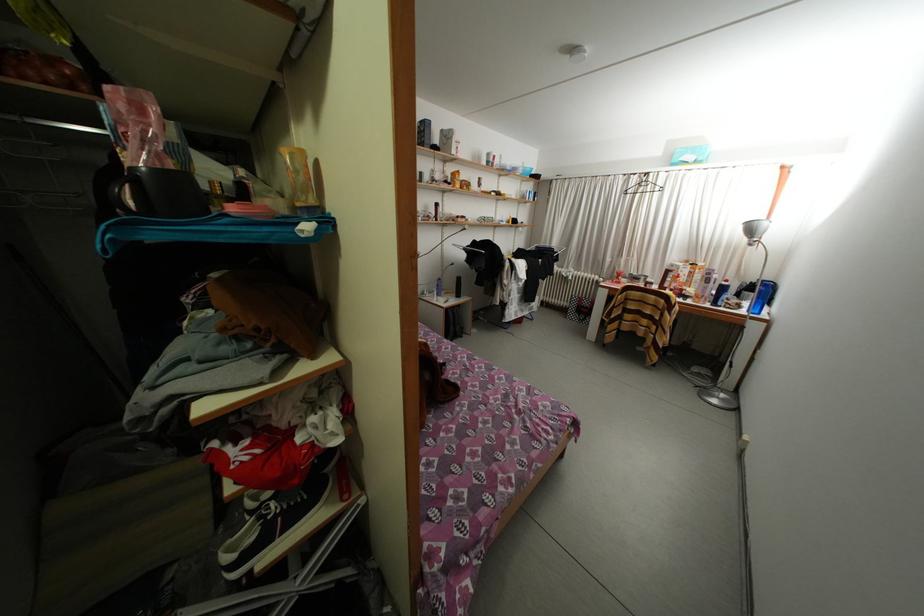
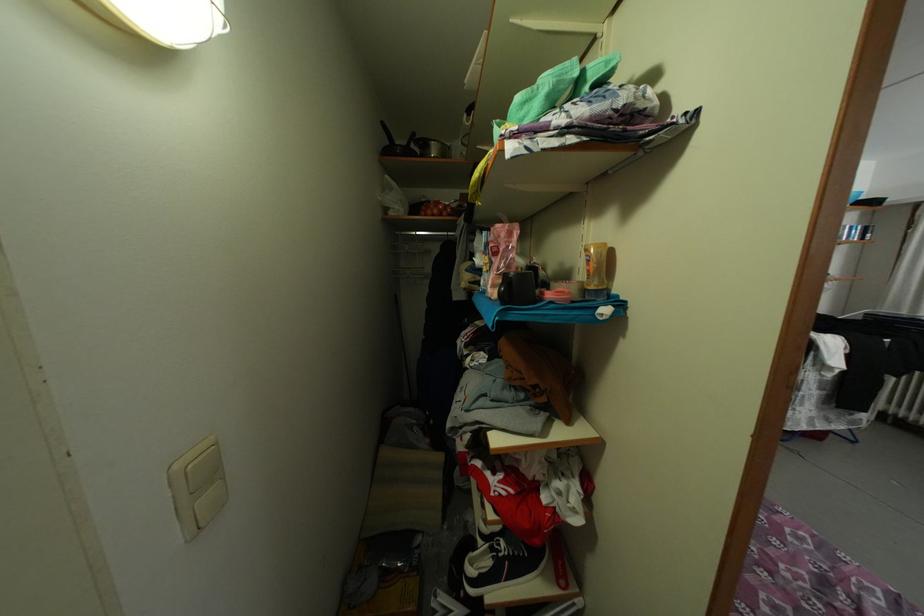
Find the pixel in the second image that matches point 306,209 in the first image.

(598, 293)